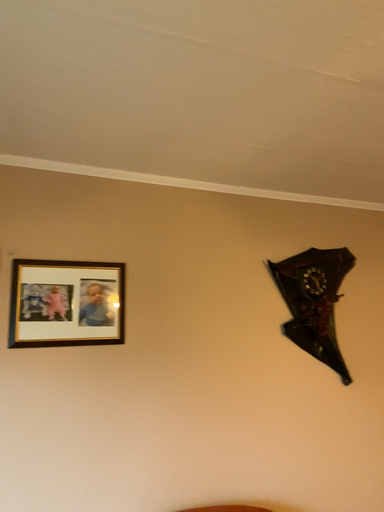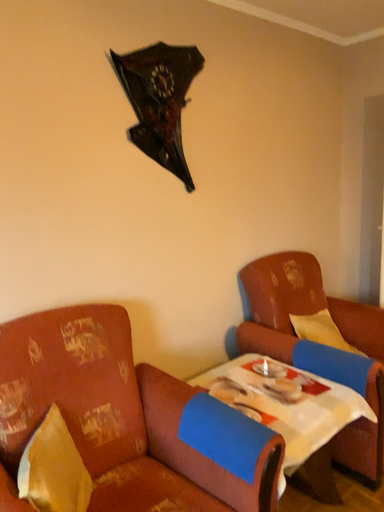
Question: How did the camera likely rotate when shooting the video?

Choices:
 (A) rotated right
 (B) rotated left

Answer: (A)